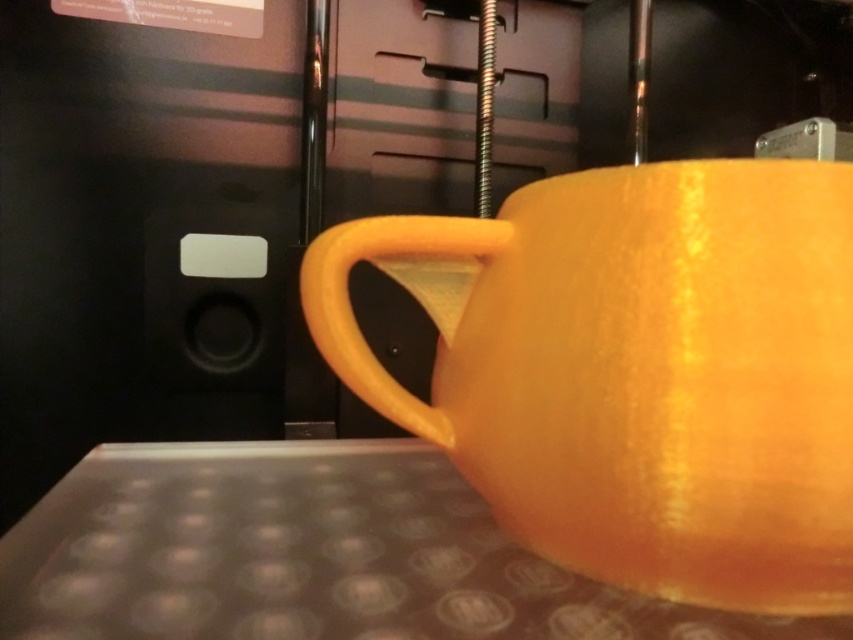
You are a robotic arm trying to pick up the glossy ceramic mug at upper center. The point you need to touch to grip it is at coordinate point (636, 371). Is this point located on the glossy ceramic mug at upper center?

Yes, the point (636, 371) is on the glossy ceramic mug at upper center, so the robotic arm can grip it there.

Based on the photo, you are setting up a 3D printer and need to place the glossy ceramic mug at upper center on the translucent plastic table at lower center. Can you fit the mug on the table without it hanging off the edge? Please explain your reasoning.

The glossy ceramic mug at upper center and the translucent plastic table at lower center are 4.48 inches apart. Since the distance between them is the vertical distance, the horizontal placement would depend on the table size. However, the description does not provide the table dimensions, so we cannot determine if the mug will fit without additional information.

You are holding a 30 cm ruler. You want to measure the distance between the camera and the point at coordinates point (825,205) in the image. Can you do it with the ruler?

The distance between the camera and the point point (825,205) is 28.00 centimeters. Since the ruler is 30 cm long, you can measure the distance with the ruler.